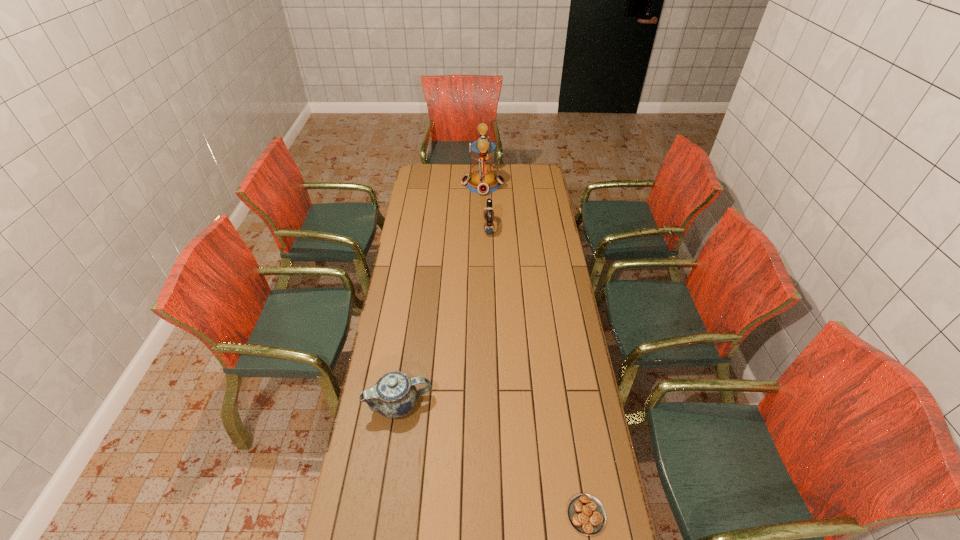
Find the location of a particular element. The image size is (960, 540). vacant space that satisfies the following two spatial constraints: 1. from the spout of the shortest object; 2. on the left side of the third farthest object is located at coordinates (383, 515).

Where is `free spot that satisfies the following two spatial constraints: 1. on the ear cup of the nearest object; 2. on the left side of the second farthest object`? The width and height of the screenshot is (960, 540). free spot that satisfies the following two spatial constraints: 1. on the ear cup of the nearest object; 2. on the left side of the second farthest object is located at coordinates (495, 515).

Image resolution: width=960 pixels, height=540 pixels. I want to click on vacant point that satisfies the following two spatial constraints: 1. from the spout of the third farthest object; 2. on the back side of the shortest object, so click(x=383, y=515).

Find the location of a particular element. The width and height of the screenshot is (960, 540). free space that satisfies the following two spatial constraints: 1. on the front-facing side of the shortest object; 2. on the right side of the tallest object is located at coordinates (486, 515).